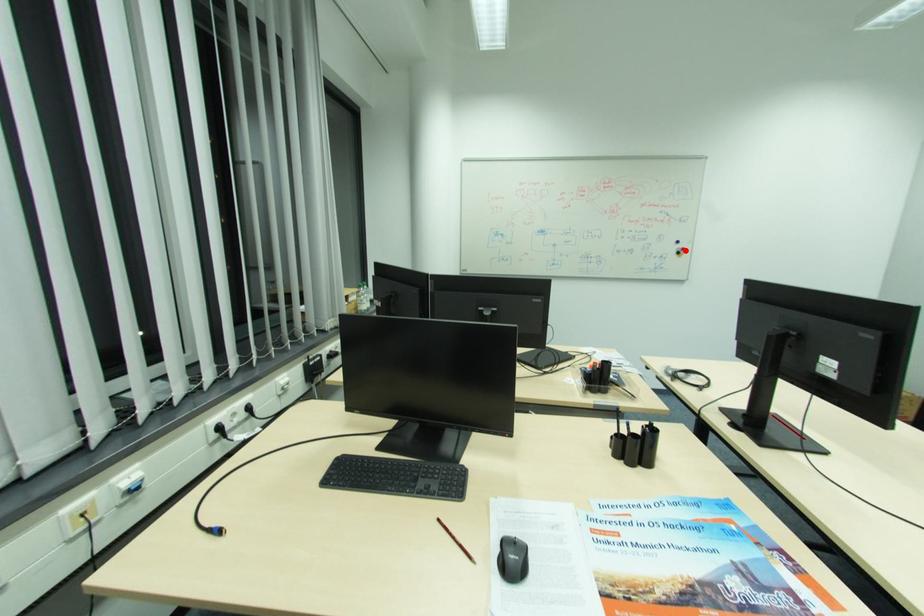
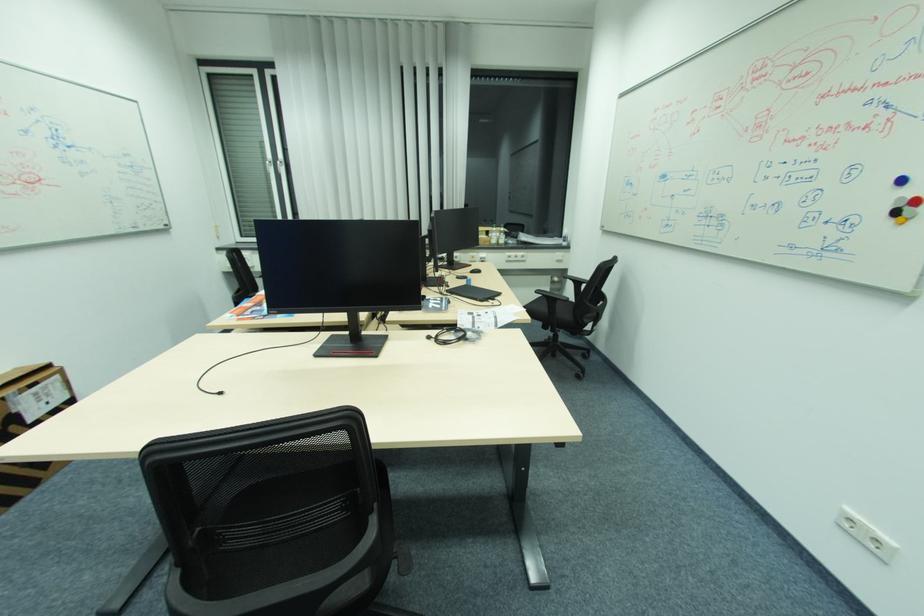
Question: A red point is marked in image1. In image2, is the corresponding 3D point closer to the camera or farther? Reply with the corresponding letter.

Choices:
 (A) The corresponding 3D point is closer.
 (B) The corresponding 3D point is farther.

Answer: (B)